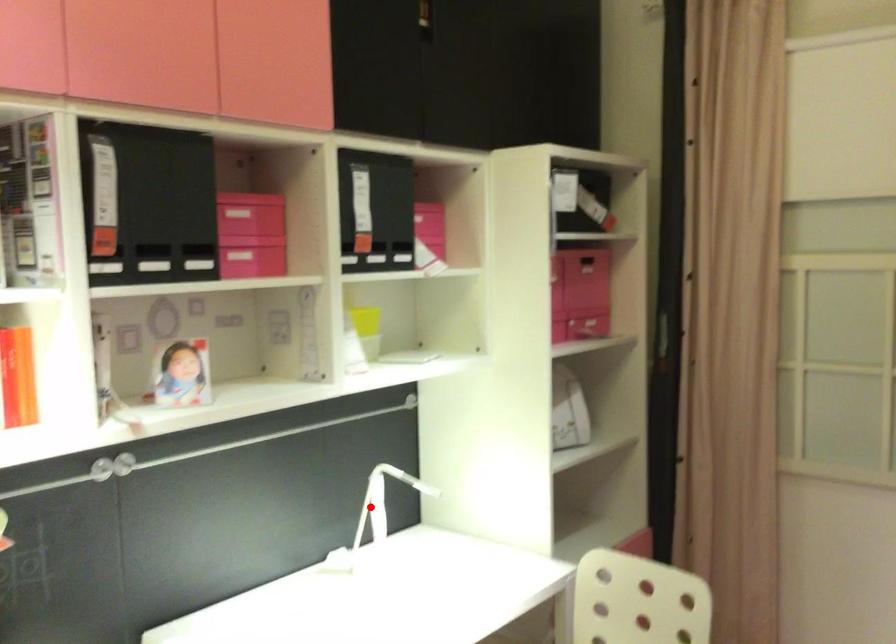
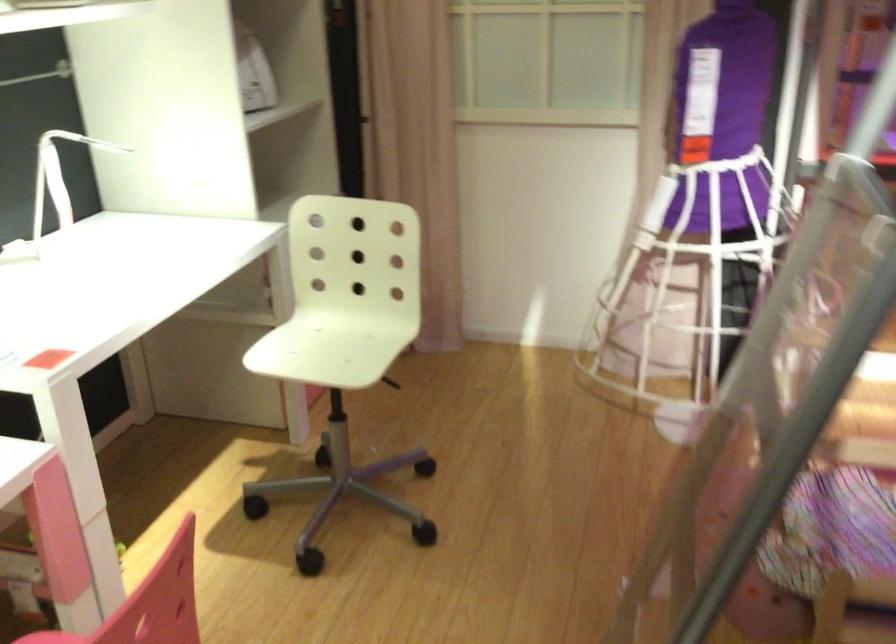
Question: I am providing you with two images of the same scene from different viewpoints. Image1 has a red point marked. In image2, the corresponding 3D location appears at what relative position? Reply with the corresponding letter.

Choices:
 (A) Closer
 (B) Farther

Answer: (A)